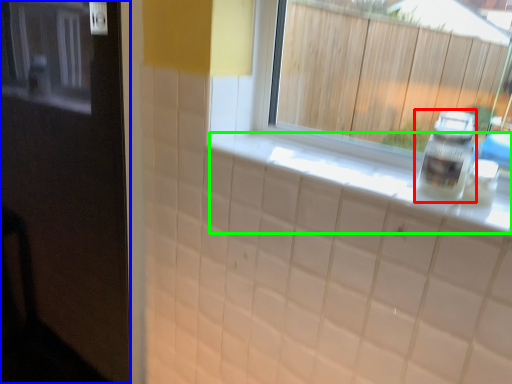
Question: Considering the real-world distances, which object is closest to bottle (highlighted by a red box)? door (highlighted by a blue box) or counter top (highlighted by a green box).

Choices:
 (A) door
 (B) counter top

Answer: (B)